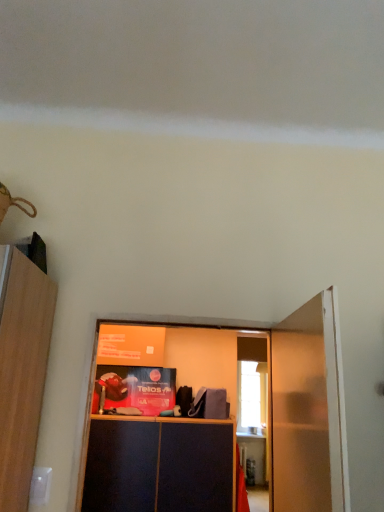
Question: From the image's perspective, is white glossy door at right located above or below dark wood cabinet at center?

Choices:
 (A) below
 (B) above

Answer: (B)

Question: Considering their positions, is white glossy door at right located in front of or behind dark wood cabinet at center?

Choices:
 (A) front
 (B) behind

Answer: (A)

Question: Would you say white glossy door at right is inside or outside dark wood cabinet at center?

Choices:
 (A) inside
 (B) outside

Answer: (B)

Question: From a real-world perspective, is dark wood cabinet at center above or below white glossy door at right?

Choices:
 (A) below
 (B) above

Answer: (A)

Question: Is dark wood cabinet at center in front of or behind white glossy door at right in the image?

Choices:
 (A) behind
 (B) front

Answer: (A)

Question: Considering the relative positions of dark wood cabinet at center and white glossy door at right in the image provided, is dark wood cabinet at center to the left or to the right of white glossy door at right?

Choices:
 (A) left
 (B) right

Answer: (A)

Question: Does point (148, 482) appear closer or farther from the camera than point (344, 495)?

Choices:
 (A) closer
 (B) farther

Answer: (B)